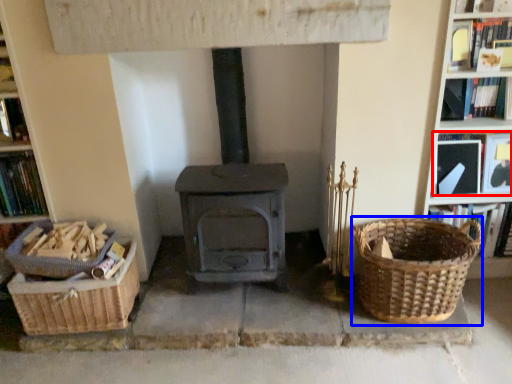
Question: Which object appears closest to the camera in this image, book (highlighted by a red box) or basket (highlighted by a blue box)?

Choices:
 (A) book
 (B) basket

Answer: (B)